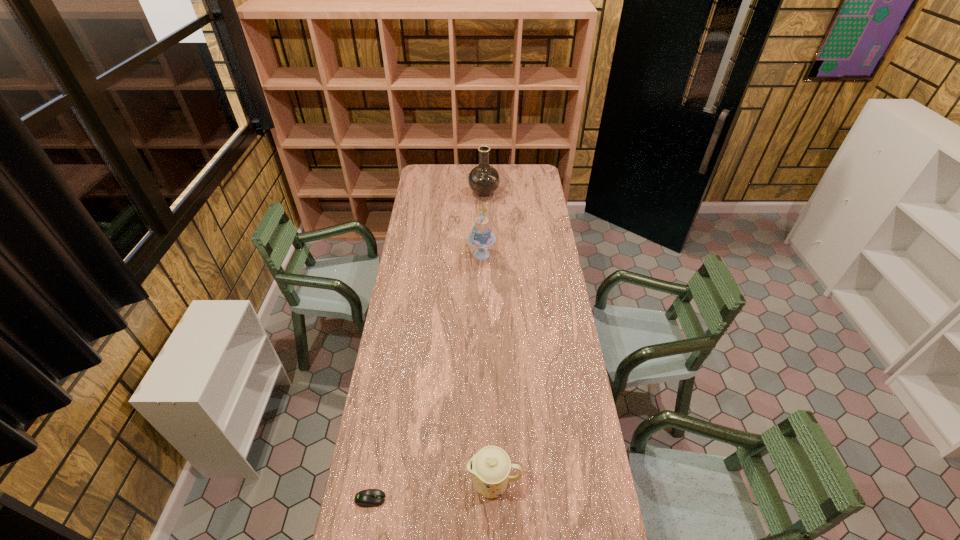
Locate an element on the screen. unoccupied area between the computer mouse and the chinaware is located at coordinates (432, 491).

Locate an element on the screen. This screenshot has width=960, height=540. empty space that is in between the chinaware and the cake is located at coordinates (488, 369).

The image size is (960, 540). In order to click on free point between the cake and the chinaware in this screenshot , I will do `click(488, 369)`.

Locate an element on the screen. The height and width of the screenshot is (540, 960). empty space between the third nearest object and the shortest object is located at coordinates (426, 376).

Identify the location of object that ranks as the second closest to the farthest object. This screenshot has height=540, width=960. (490, 467).

Image resolution: width=960 pixels, height=540 pixels. I want to click on object that ranks as the closest to the chinaware, so click(x=367, y=498).